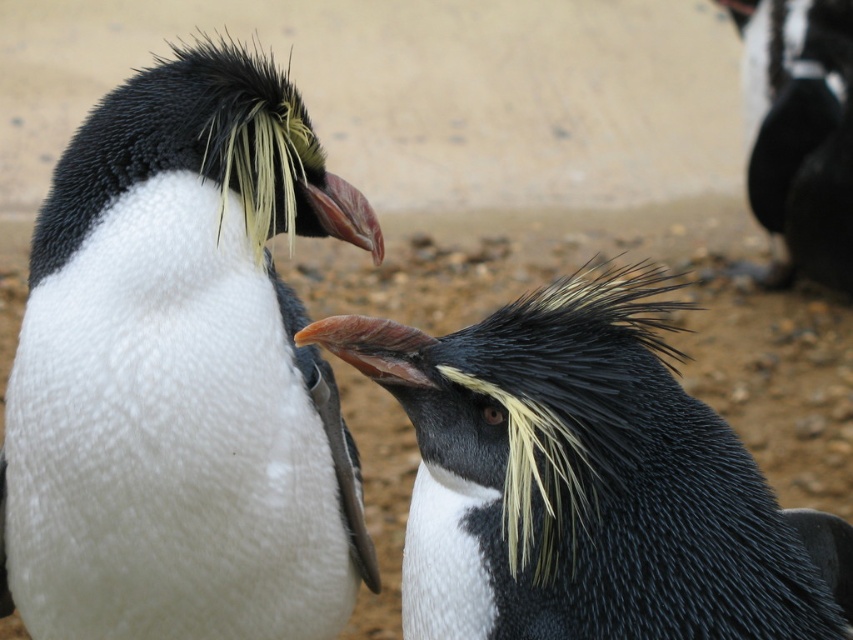
Consider the image. Between black and white feathers at center and black matte penguin at upper right, which one is positioned lower?

black and white feathers at center

How distant is black and white feathers at center from black matte penguin at upper right?

They are 3.06 meters apart.

I want to click on black and white feathers at center, so point(587,481).

This screenshot has width=853, height=640. In order to click on black and white feathers at center in this screenshot , I will do `click(587, 481)`.

Based on the photo, is white soft penguin at left wider than black and white feathers at center?

Yes.

Can you confirm if white soft penguin at left is positioned below black and white feathers at center?

No, white soft penguin at left is not below black and white feathers at center.

Who is more forward, (318, 150) or (560, 605)?

Point (560, 605) is more forward.

Where is `white soft penguin at left`? white soft penguin at left is located at coordinates (181, 374).

Between white soft penguin at left and black matte penguin at upper right, which one appears on the left side from the viewer's perspective?

white soft penguin at left is more to the left.

Who is shorter, white soft penguin at left or black matte penguin at upper right?

With less height is white soft penguin at left.

This screenshot has height=640, width=853. I want to click on white soft penguin at left, so click(181, 374).